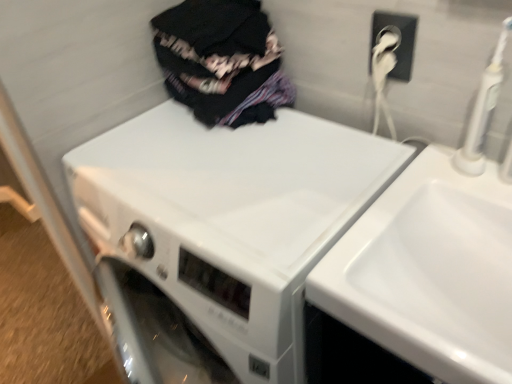
Image resolution: width=512 pixels, height=384 pixels. What are the coordinates of `vacant point above white glossy washing machine at center (from a real-world perspective)` in the screenshot? It's located at (212, 167).